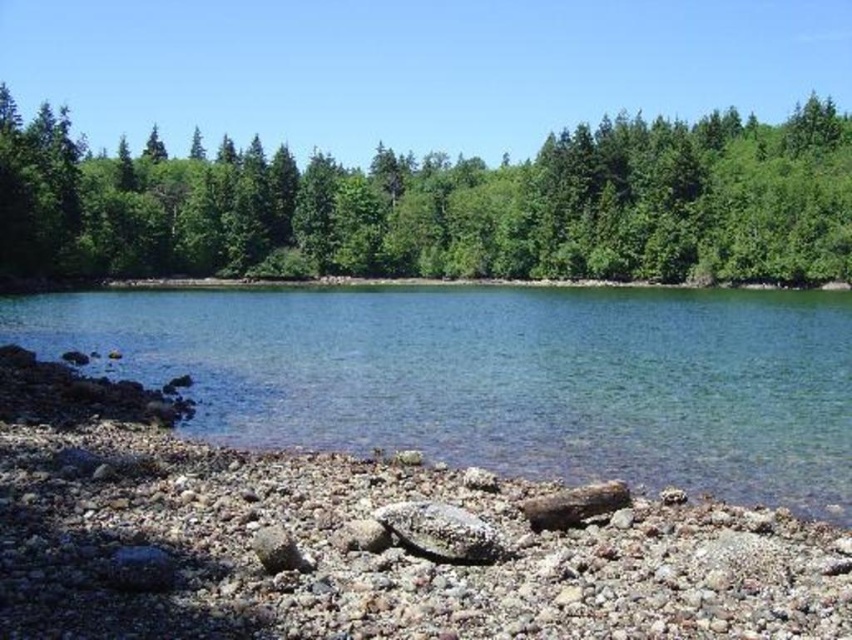
Question: Does clear water at center lie in front of green leafy trees at upper center?

Choices:
 (A) no
 (B) yes

Answer: (B)

Question: Which point is closer to the camera?

Choices:
 (A) green leafy trees at upper center
 (B) clear water at center

Answer: (B)

Question: Does clear water at center appear over green leafy trees at upper center?

Choices:
 (A) no
 (B) yes

Answer: (A)

Question: Among these objects, which one is farthest from the camera?

Choices:
 (A) clear water at center
 (B) green leafy trees at upper center

Answer: (B)

Question: Can you confirm if clear water at center is positioned to the right of green leafy trees at upper center?

Choices:
 (A) yes
 (B) no

Answer: (A)